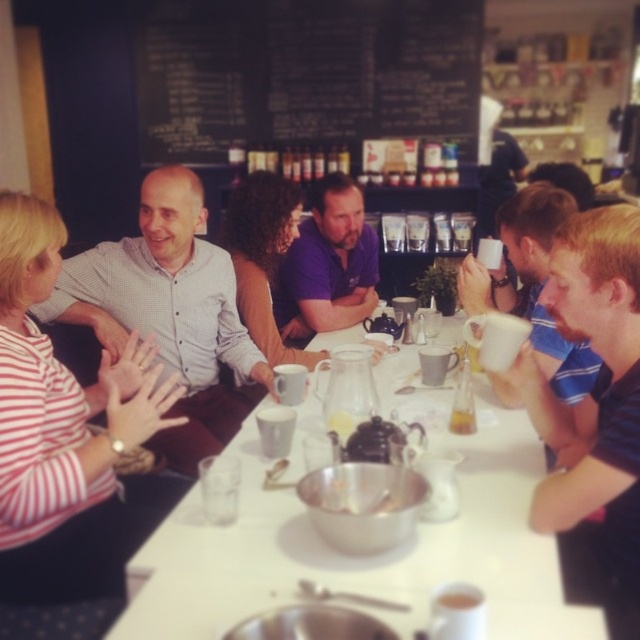
Question: Which object is closer to the camera taking this photo?

Choices:
 (A) purple cotton shirt at center
 (B) translucent glass cup at table center
 (C) white glossy table at center
 (D) black chalkboard at upper center

Answer: (C)

Question: Does purple cotton shirt at center appear on the left side of matte white cup at center?

Choices:
 (A) no
 (B) yes

Answer: (B)

Question: Which object is the closest to the matte white shirt at center?

Choices:
 (A) translucent glass cup at table center
 (B) matte white cup at center

Answer: (A)

Question: Does black chalkboard at upper center have a larger size compared to translucent glass cup at table center?

Choices:
 (A) no
 (B) yes

Answer: (B)

Question: Can you confirm if black chalkboard at upper center is positioned above translucent glass cup at table center?

Choices:
 (A) no
 (B) yes

Answer: (B)

Question: Which object appears closest to the camera in this image?

Choices:
 (A) purple cotton shirt at center
 (B) matte white cup at center

Answer: (B)